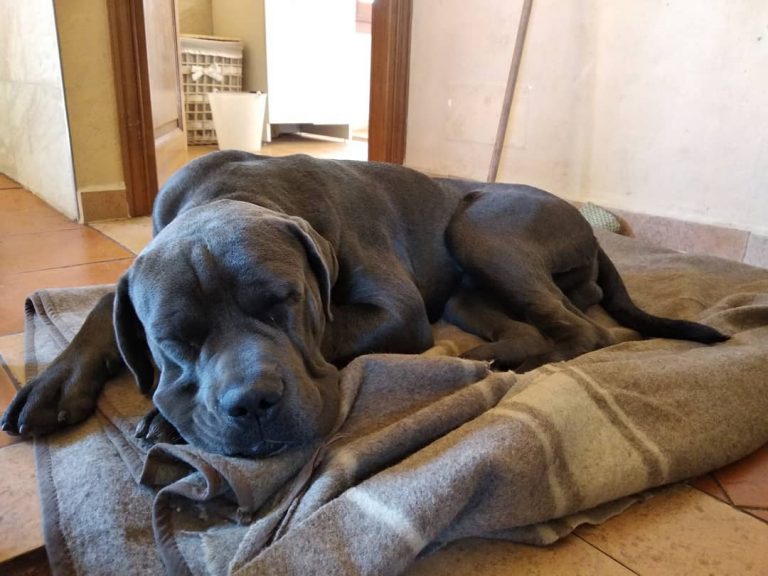
Locate an element on the screen. The height and width of the screenshot is (576, 768). wall is located at coordinates coord(689,79), coord(17,94), coord(240,16), coord(184,15).